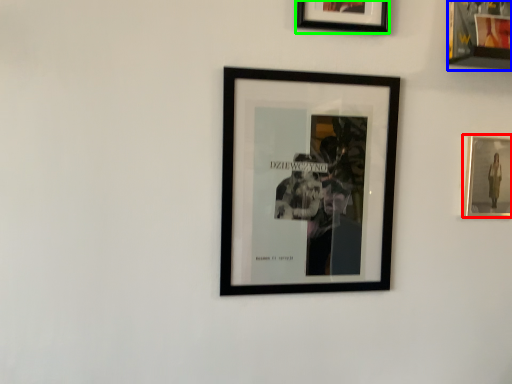
Question: Which object is the farthest from picture frame (highlighted by a red box)? Choose among these: picture frame (highlighted by a blue box) or picture frame (highlighted by a green box).

Choices:
 (A) picture frame
 (B) picture frame

Answer: (B)